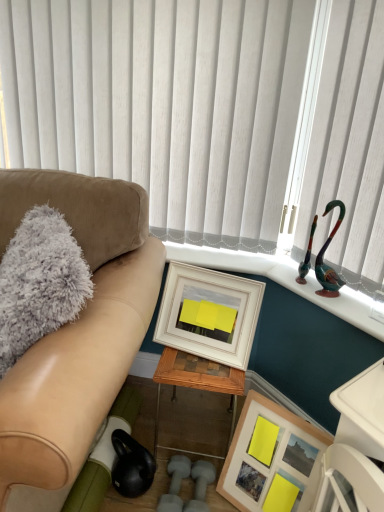
Question: Relative to shiny green glass swan at upper right, is wooden framed picture at lower right, which ranks as the 2th picture frame in top-to-bottom order, in front or behind?

Choices:
 (A) behind
 (B) front

Answer: (B)

Question: Is wooden framed picture at lower right, which ranks as the 2th picture frame in top-to-bottom order, wider or thinner than shiny green glass swan at upper right?

Choices:
 (A) thin
 (B) wide

Answer: (B)

Question: Which object is the farthest from the suede couch at left?

Choices:
 (A) matte white picture frame at center, which appears as the second picture frame when ordered from the bottom
 (B) woodenmaterial/texturetable at center
 (C) white vertical blinds at upper center
 (D) wooden framed picture at lower right, the 1th picture frame from the bottom
 (E) shiny green glass swan at upper right

Answer: (E)

Question: Which is farther from the matte white picture frame at center, which is the first picture frame in top-to-bottom order?

Choices:
 (A) gray fluffy pillow at left
 (B) suede couch at left
 (C) shiny green glass swan at upper right
 (D) white vertical blinds at upper center
 (E) woodenmaterial/texturetable at center

Answer: (D)